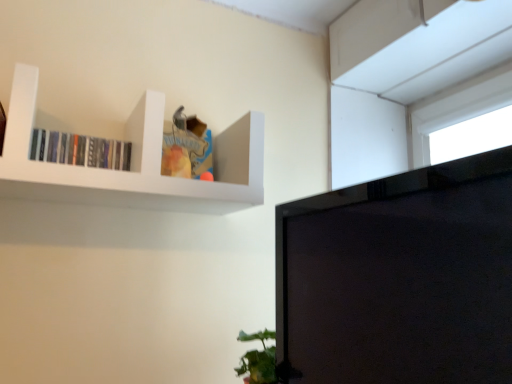
Question: Does black glossy monitor at upper right have a larger size compared to white matte shelf at upper left?

Choices:
 (A) yes
 (B) no

Answer: (A)

Question: Considering the relative sizes of black glossy monitor at upper right and white matte shelf at upper left in the image provided, is black glossy monitor at upper right shorter than white matte shelf at upper left?

Choices:
 (A) no
 (B) yes

Answer: (A)

Question: Is black glossy monitor at upper right thinner than white matte shelf at upper left?

Choices:
 (A) yes
 (B) no

Answer: (A)

Question: Can you confirm if black glossy monitor at upper right is positioned to the left of white matte shelf at upper left?

Choices:
 (A) yes
 (B) no

Answer: (B)

Question: Can you confirm if black glossy monitor at upper right is taller than white matte shelf at upper left?

Choices:
 (A) yes
 (B) no

Answer: (A)

Question: Considering the positions of black glossy monitor at upper right and white matte shelf at upper left in the image, is black glossy monitor at upper right wider or thinner than white matte shelf at upper left?

Choices:
 (A) thin
 (B) wide

Answer: (A)

Question: From a real-world perspective, is black glossy monitor at upper right positioned above or below white matte shelf at upper left?

Choices:
 (A) below
 (B) above

Answer: (A)

Question: Relative to white matte shelf at upper left, is black glossy monitor at upper right in front or behind?

Choices:
 (A) front
 (B) behind

Answer: (A)

Question: Is black glossy monitor at upper right to the left or to the right of white matte shelf at upper left in the image?

Choices:
 (A) right
 (B) left

Answer: (A)

Question: Do you think black glossy monitor at upper right is within matte black books at upper left, or outside of it?

Choices:
 (A) outside
 (B) inside

Answer: (A)

Question: From the image's perspective, is black glossy monitor at upper right above or below matte black books at upper left?

Choices:
 (A) above
 (B) below

Answer: (B)

Question: From a real-world perspective, is black glossy monitor at upper right above or below matte black books at upper left?

Choices:
 (A) above
 (B) below

Answer: (B)

Question: Is black glossy monitor at upper right to the left or to the right of matte black books at upper left in the image?

Choices:
 (A) left
 (B) right

Answer: (B)

Question: From a real-world perspective, is white matte shelf at upper left positioned above or below black glossy monitor at upper right?

Choices:
 (A) above
 (B) below

Answer: (A)

Question: Is white matte shelf at upper left in front of or behind black glossy monitor at upper right in the image?

Choices:
 (A) behind
 (B) front

Answer: (A)